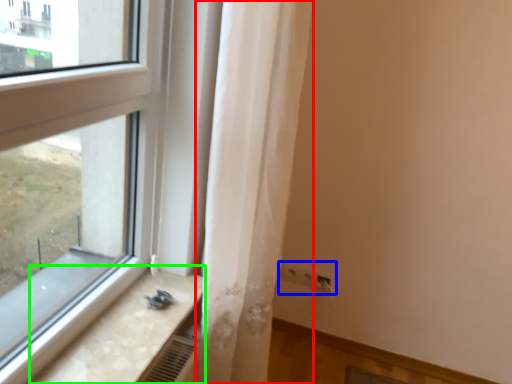
Question: Which object is the closest to the curtain (highlighted by a red box)? Choose among these: electric outlet (highlighted by a blue box) or counter top (highlighted by a green box).

Choices:
 (A) electric outlet
 (B) counter top

Answer: (B)